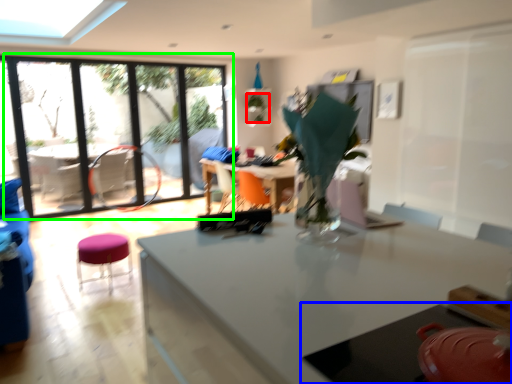
Question: Which object is positioned closest to plant (highlighted by a red box)? Select from table (highlighted by a blue box) and window (highlighted by a green box).

Choices:
 (A) table
 (B) window

Answer: (B)